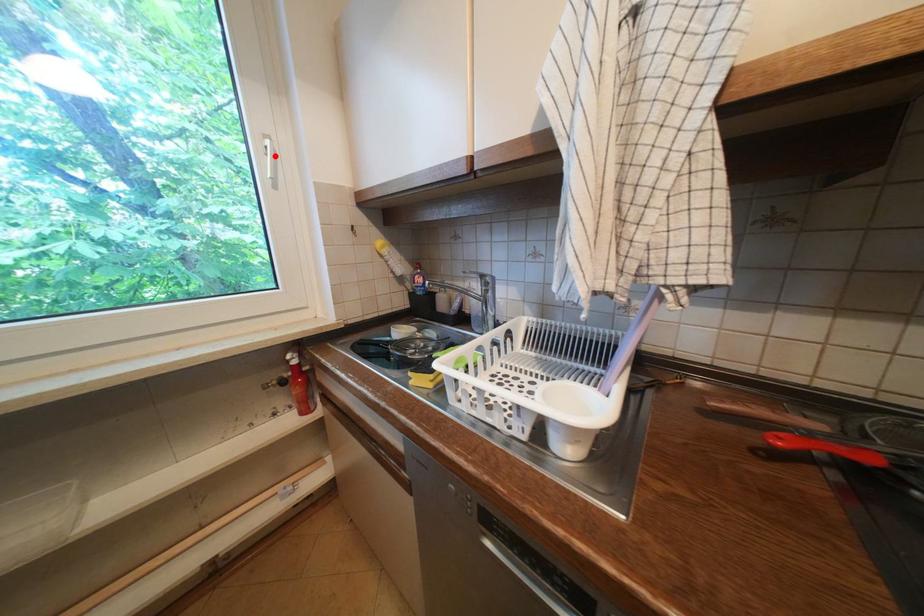
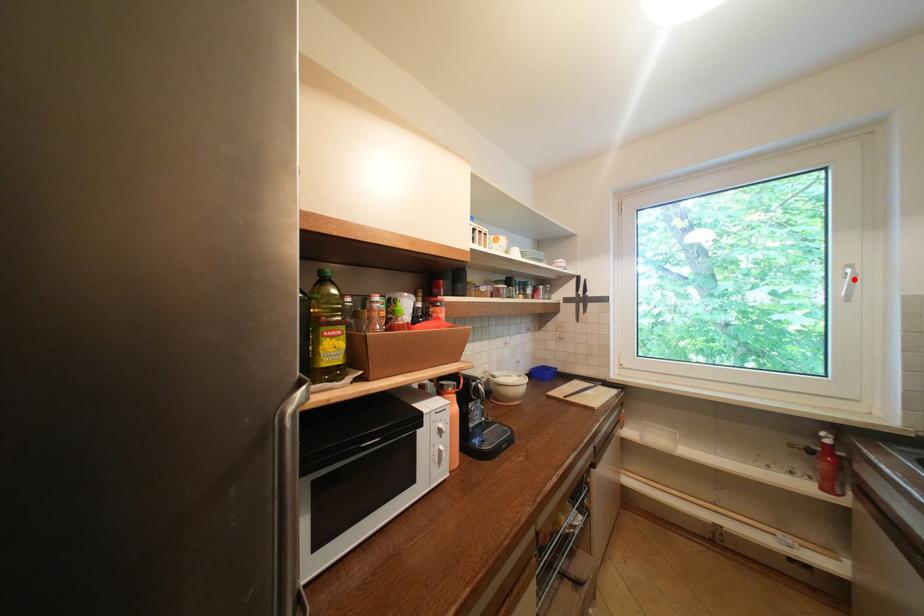
I am providing you with two images of the same scene from different viewpoints. A red point is marked on the first image and another point is marked on the second image. Is the red point in image1 aligned with the point shown in image2?

Yes